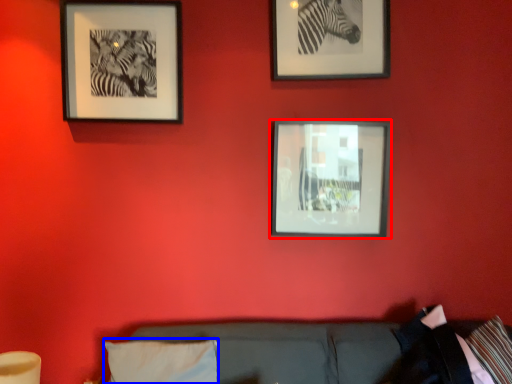
Question: Which object appears closest to the camera in this image, picture frame (highlighted by a red box) or pillow (highlighted by a blue box)?

Choices:
 (A) picture frame
 (B) pillow

Answer: (B)